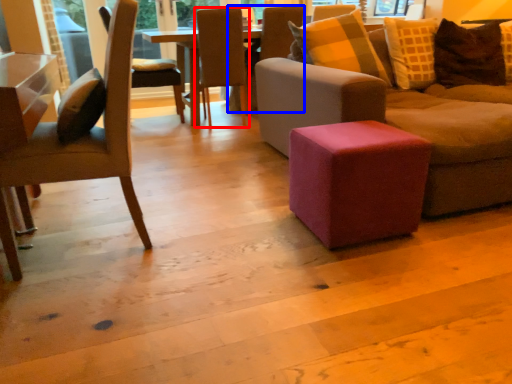
Question: Among these objects, which one is nearest to the camera, chair (highlighted by a red box) or chair (highlighted by a blue box)?

Choices:
 (A) chair
 (B) chair

Answer: (A)